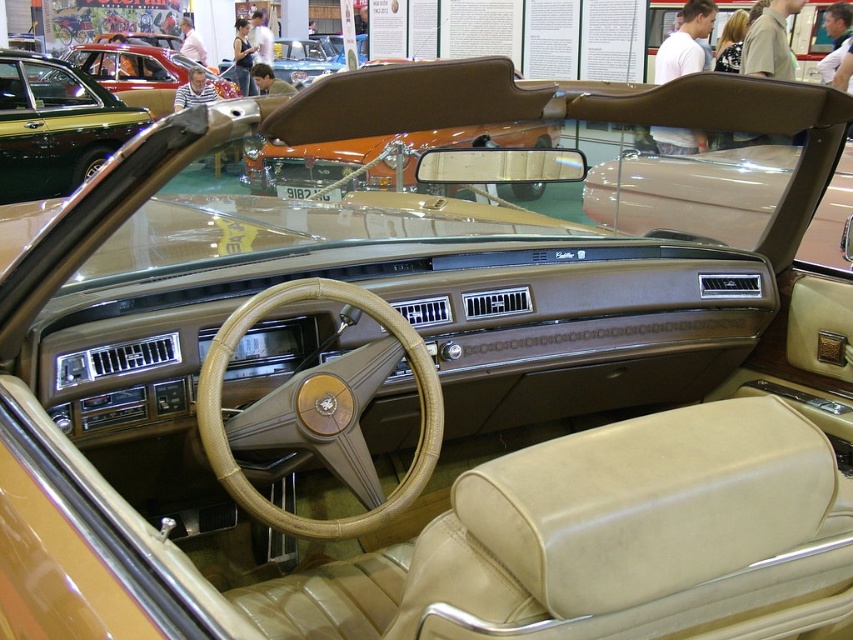
Question: Can you confirm if leather textured steering wheel at center is thinner than matte brown convertible top at center?

Choices:
 (A) yes
 (B) no

Answer: (A)

Question: Can you confirm if matte gold steering wheel at center is positioned to the left of matte brown convertible top at center?

Choices:
 (A) no
 (B) yes

Answer: (B)

Question: Which is farther from the matte gold steering wheel at center?

Choices:
 (A) leather textured steering wheel at center
 (B) matte brown convertible top at center

Answer: (A)

Question: Which object is farther from the camera taking this photo?

Choices:
 (A) matte gold steering wheel at center
 (B) leather textured steering wheel at center

Answer: (A)

Question: Is the position of matte gold steering wheel at center more distant than that of matte brown convertible top at center?

Choices:
 (A) no
 (B) yes

Answer: (B)

Question: Which point is farther to the camera?

Choices:
 (A) (345, 168)
 (B) (83, 84)

Answer: (B)